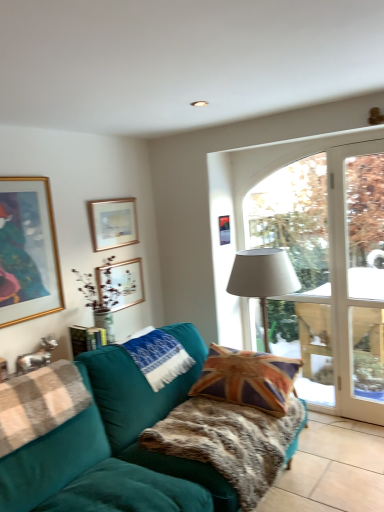
Where is `vacant area situated to the left side of white glass door at right`? The width and height of the screenshot is (384, 512). vacant area situated to the left side of white glass door at right is located at coordinates (348, 428).